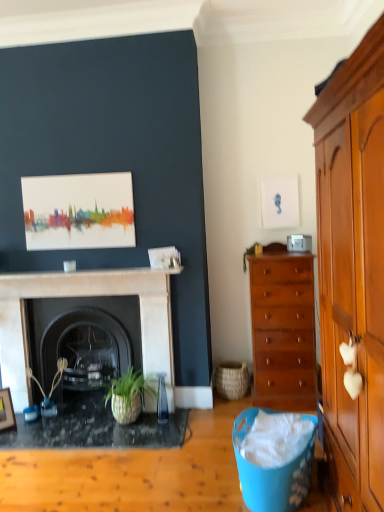
The image size is (384, 512). In order to click on free space to the back side of matte white coffee cup at upper center in this screenshot , I will do `click(72, 271)`.